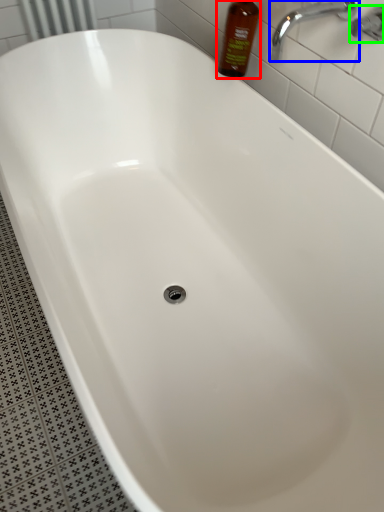
Question: Which object is positioned farthest from bottle (highlighted by a red box)? Select from tap (highlighted by a blue box) and plumbing fixture (highlighted by a green box).

Choices:
 (A) tap
 (B) plumbing fixture

Answer: (B)